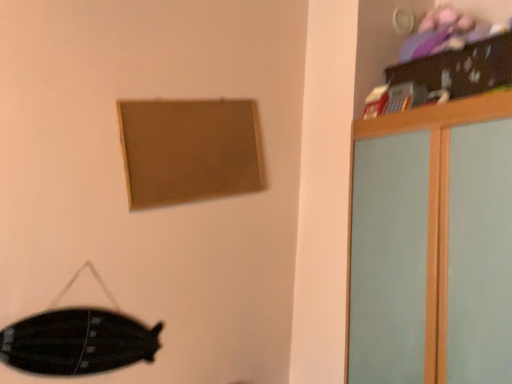
Question: Is matte brown picture frame at upper center inside or outside of light wood dresser at upper right?

Choices:
 (A) inside
 (B) outside

Answer: (B)

Question: Looking at the image, does matte brown picture frame at upper center seem bigger or smaller compared to light wood dresser at upper right?

Choices:
 (A) small
 (B) big

Answer: (A)

Question: Which object is positioned closest to the matte brown picture frame at upper center?

Choices:
 (A) black matte swivel chair at lower left
 (B) light wood dresser at upper right

Answer: (A)

Question: Which of these objects is positioned closest to the black matte swivel chair at lower left?

Choices:
 (A) light wood dresser at upper right
 (B) matte brown picture frame at upper center

Answer: (B)